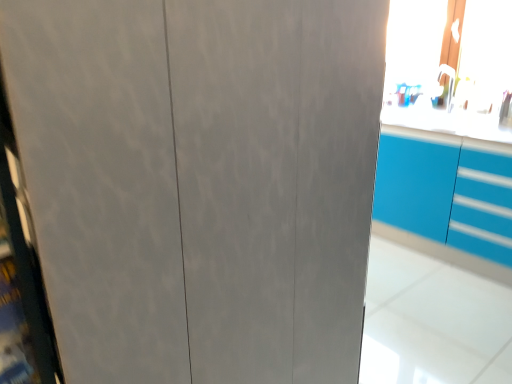
Question: In terms of size, does blue glossy cabinet at upper right appear bigger or smaller than transparent plastic window screen at upper right?

Choices:
 (A) big
 (B) small

Answer: (A)

Question: Relative to transparent plastic window screen at upper right, is blue glossy cabinet at upper right in front or behind?

Choices:
 (A) front
 (B) behind

Answer: (A)

Question: Considering the relative positions of blue glossy cabinet at upper right and transparent plastic window screen at upper right in the image provided, is blue glossy cabinet at upper right to the left or to the right of transparent plastic window screen at upper right?

Choices:
 (A) left
 (B) right

Answer: (A)

Question: From the image's perspective, is transparent plastic window screen at upper right positioned above or below blue glossy cabinet at upper right?

Choices:
 (A) below
 (B) above

Answer: (B)

Question: Visually, is transparent plastic window screen at upper right positioned to the left or to the right of blue glossy cabinet at upper right?

Choices:
 (A) left
 (B) right

Answer: (B)

Question: Is transparent plastic window screen at upper right spatially inside blue glossy cabinet at upper right, or outside of it?

Choices:
 (A) outside
 (B) inside

Answer: (A)

Question: Relative to blue glossy cabinet at upper right, is transparent plastic window screen at upper right in front or behind?

Choices:
 (A) behind
 (B) front

Answer: (A)